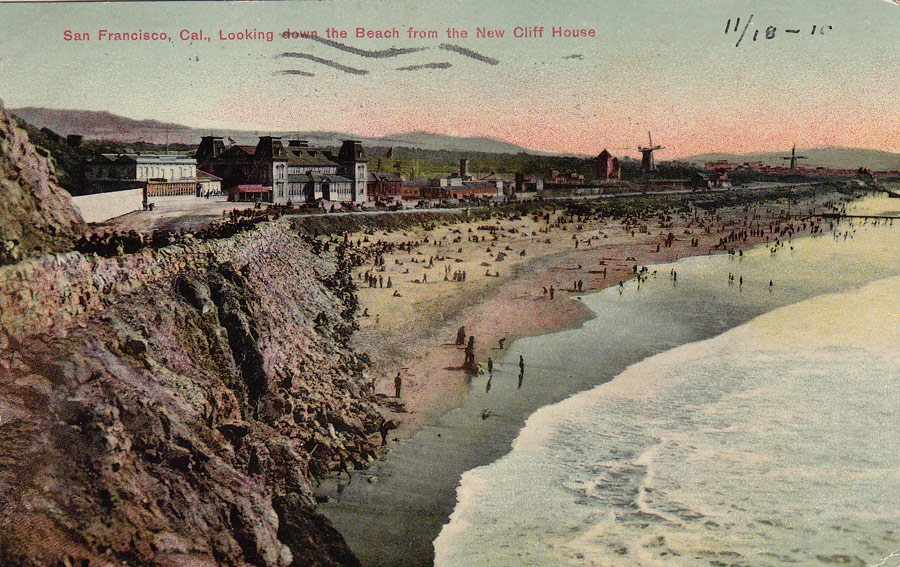
I want to click on window, so click(x=362, y=169).